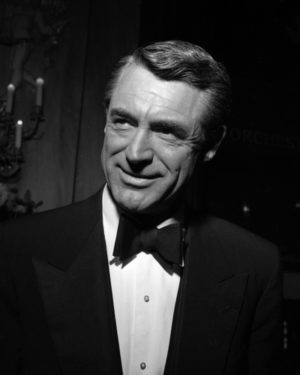
Where is `candle`? candle is located at coordinates (8, 95), (18, 135), (39, 90).